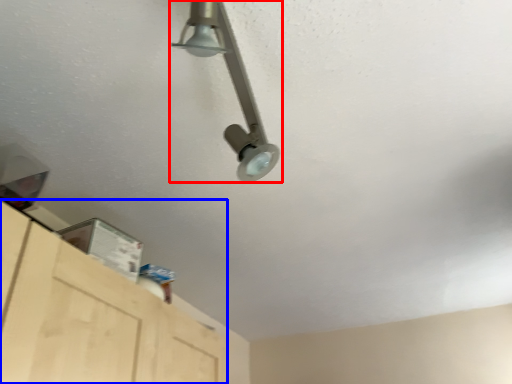
Question: Which point is closer to the camera, lamp (highlighted by a red box) or cabinetry (highlighted by a blue box)?

Choices:
 (A) lamp
 (B) cabinetry

Answer: (A)